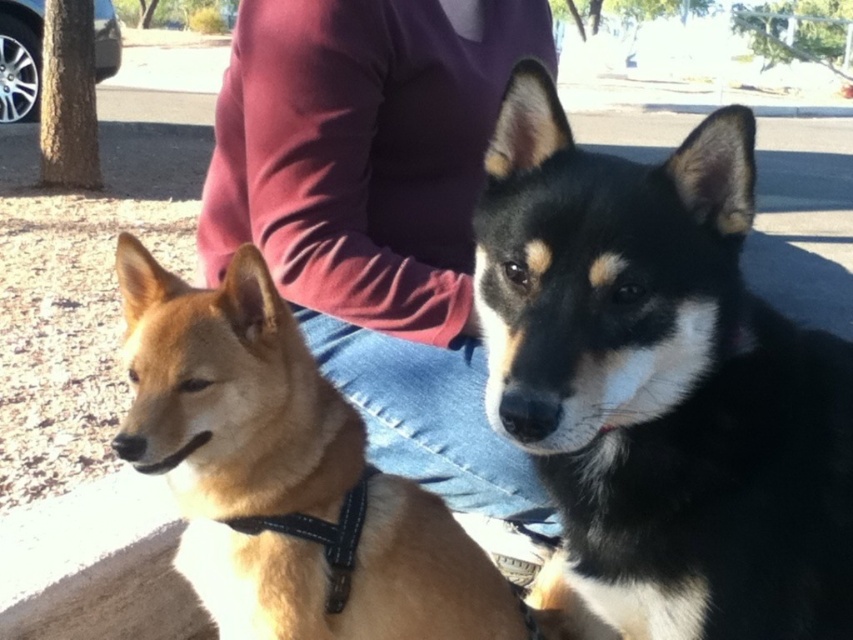
Does golden fur dog at center have a larger size compared to black fabric neckband at lower left?

Yes.

Does point (138, 376) come in front of point (346, 513)?

Yes, point (138, 376) is closer to viewer.

The image size is (853, 640). Find the location of `golden fur dog at center`. golden fur dog at center is located at coordinates (285, 476).

Who is more forward, [720,548] or [405,16]?

Point [720,548]

Which is more to the left, black fur dog at center or purple fabric shirt at upper center?

Positioned to the left is purple fabric shirt at upper center.

Is point (619, 429) less distant than point (445, 211)?

That is True.

This screenshot has height=640, width=853. I want to click on black fur dog at center, so click(662, 381).

Is black fur dog at center further to camera compared to black fabric neckband at lower left?

No, it is not.

Between point (575, 272) and point (248, 524), which one is positioned behind?

Point (248, 524)

Where is `black fur dog at center`? The image size is (853, 640). black fur dog at center is located at coordinates [x=662, y=381].